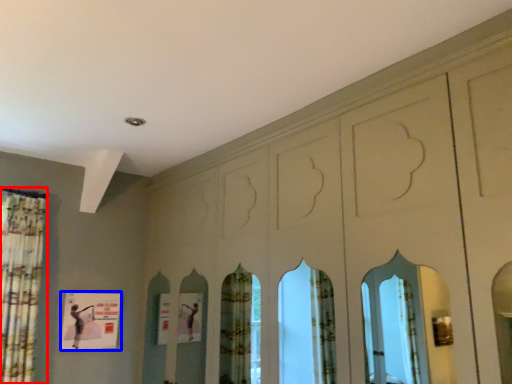
Question: Which point is further to the camera, shower curtain (highlighted by a red box) or poster (highlighted by a blue box)?

Choices:
 (A) shower curtain
 (B) poster

Answer: (B)